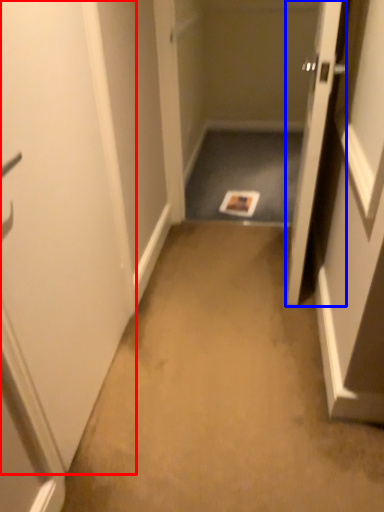
Question: Among these objects, which one is nearest to the camera, door (highlighted by a red box) or door (highlighted by a blue box)?

Choices:
 (A) door
 (B) door

Answer: (A)